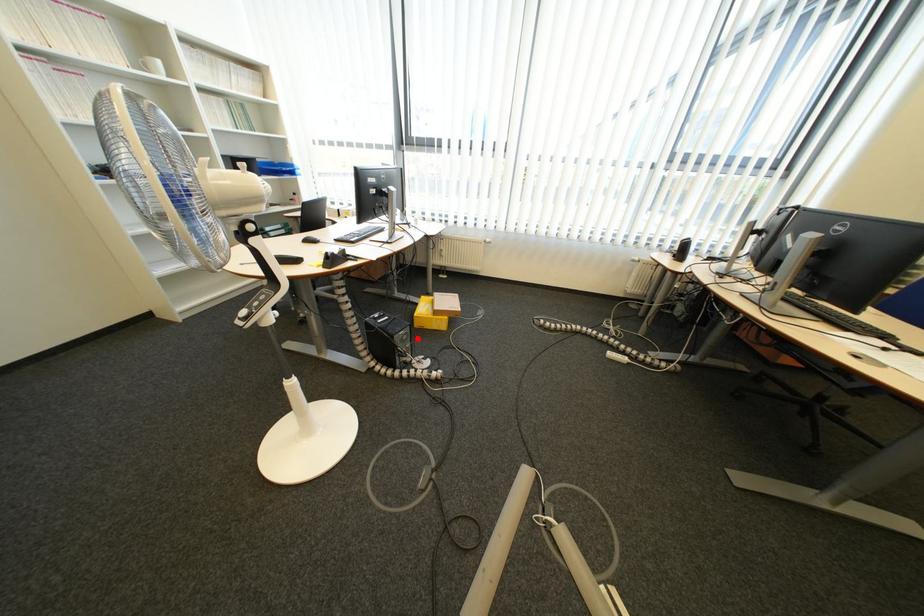
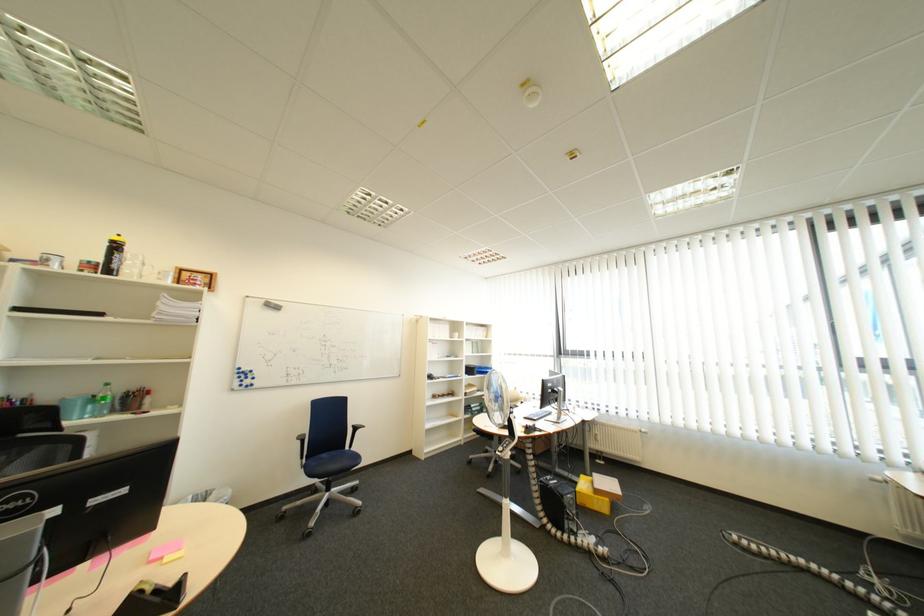
In the second image, find the point that corresponds to the highlighted location in the first image.

(585, 503)